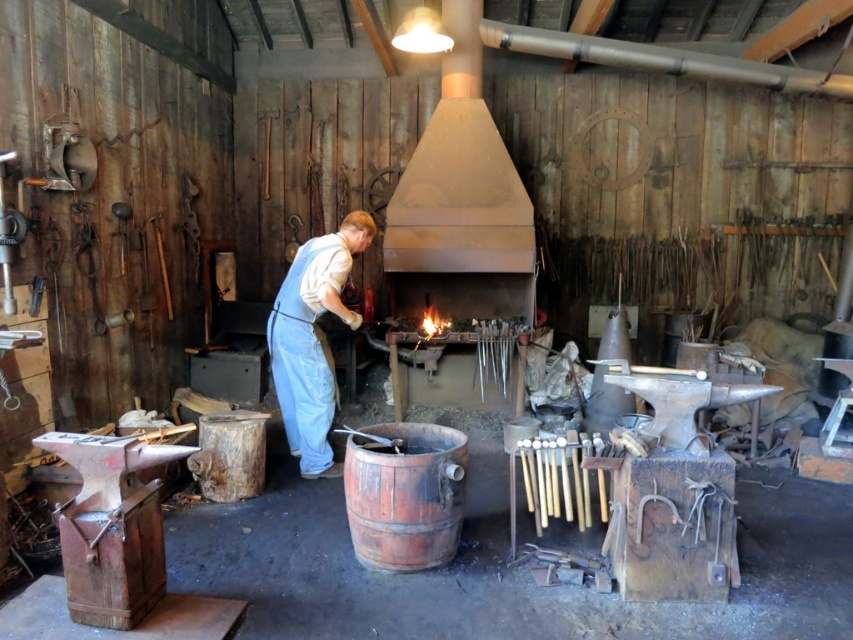
You are a visitor in the blacksmith shop and see the rustic wooden barrel at center and the denim overalls at center. Which object is positioned more to the right side of the scene?

The rustic wooden barrel at center is positioned to the right of the denim overalls at center, so the rustic wooden barrel at center is more to the right side of the scene.

In the scene shown: You are a visitor in the blacksmith workshop and want to touch the rustic wooden barrel at center and denim overalls at center. Which object can you reach first without moving your position?

The rustic wooden barrel at center is closer to the viewer than denim overalls at center, so you can reach the rustic wooden barrel at center first without moving your position.

You are a customer in the blacksmith shop and want to place a heavy metal object on the rustic wooden barrel at center. Can you do this without the barrel tipping over, considering the denim overalls at center is nearby?

The rustic wooden barrel at center is not as tall as denim overalls at center, so it might be more stable to place the heavy object on the barrel since its lower height could provide a more stable base.